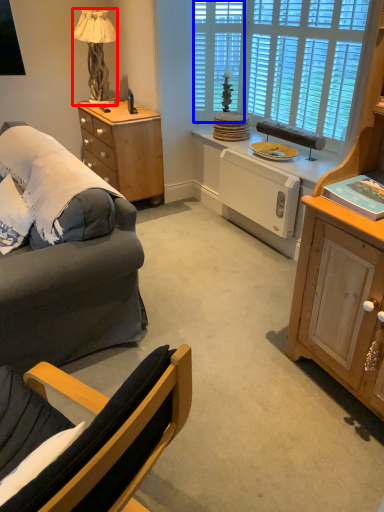
Question: Which of the following is the closest to the observer, lamp (highlighted by a red box) or glass door (highlighted by a blue box)?

Choices:
 (A) lamp
 (B) glass door

Answer: (A)